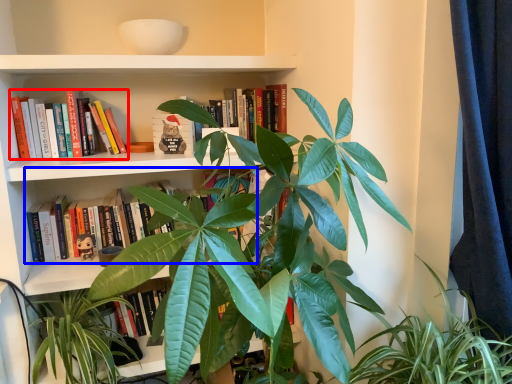
Question: Among these objects, which one is farthest to the camera, book (highlighted by a red box) or book (highlighted by a blue box)?

Choices:
 (A) book
 (B) book

Answer: (B)